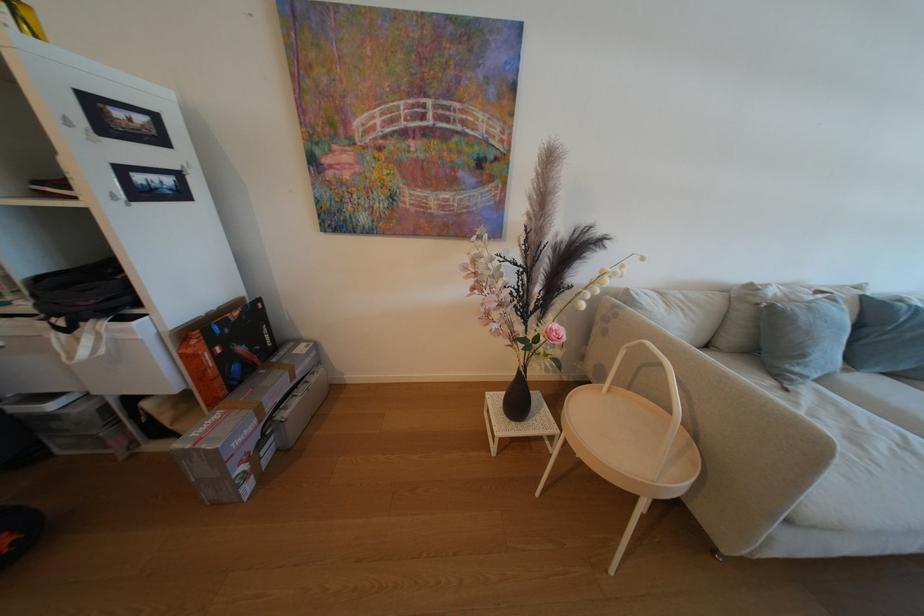
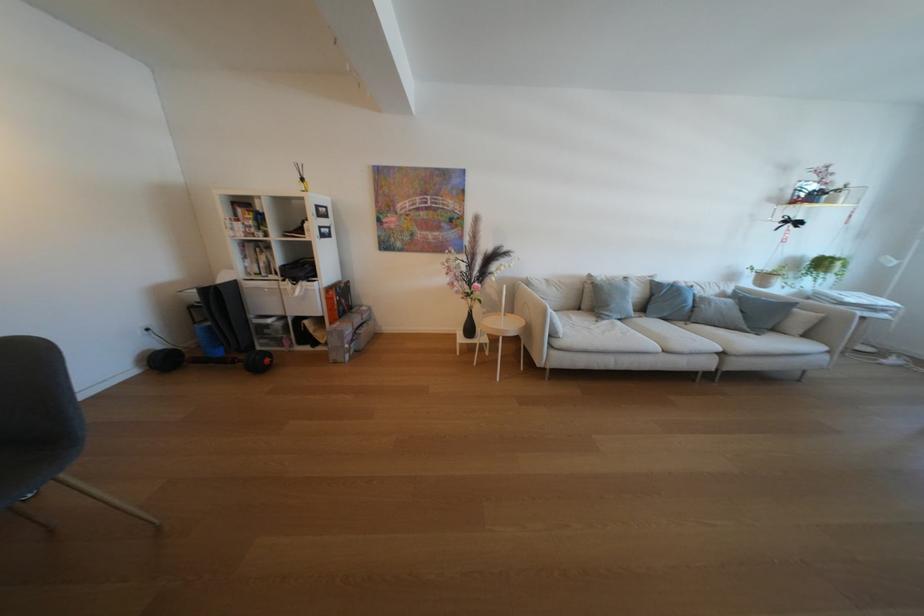
The point at (62,455) is marked in the first image. Where is the corresponding point in the second image?

(265, 351)